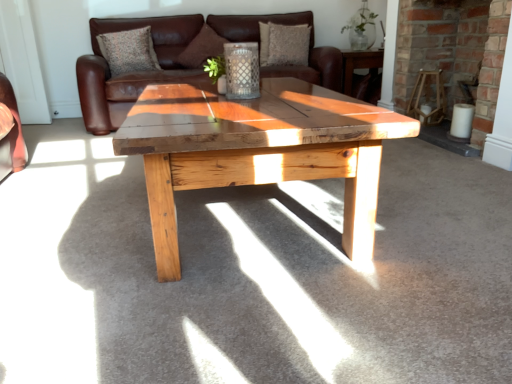
Question: Is wooden chair at right in front of or behind brick fireplace at center in the image?

Choices:
 (A) behind
 (B) front

Answer: (A)

Question: From the image's perspective, is wooden chair at right located above or below brick fireplace at center?

Choices:
 (A) above
 (B) below

Answer: (B)

Question: Which is nearer to the brown suede pillow at center, positioned as the second pillow in left-to-right order?

Choices:
 (A) wooden chair at right
 (B) brick fireplace at center
 (C) textured fabric pillow at upper center, the 1th pillow when ordered from left to right
 (D) textured brown pillow at upper center, marked as the third pillow in a left-to-right arrangement
 (E) brown leather couch at center

Answer: (E)

Question: Based on their relative distances, which object is nearer to the brown leather couch at center?

Choices:
 (A) textured brown pillow at upper center, marked as the 1th pillow in a right-to-left arrangement
 (B) textured fabric pillow at upper center, which appears as the 3th pillow when viewed from the right
 (C) brick fireplace at center
 (D) wooden chair at right
 (E) brown suede pillow at center, positioned as the second pillow in left-to-right order

Answer: (B)